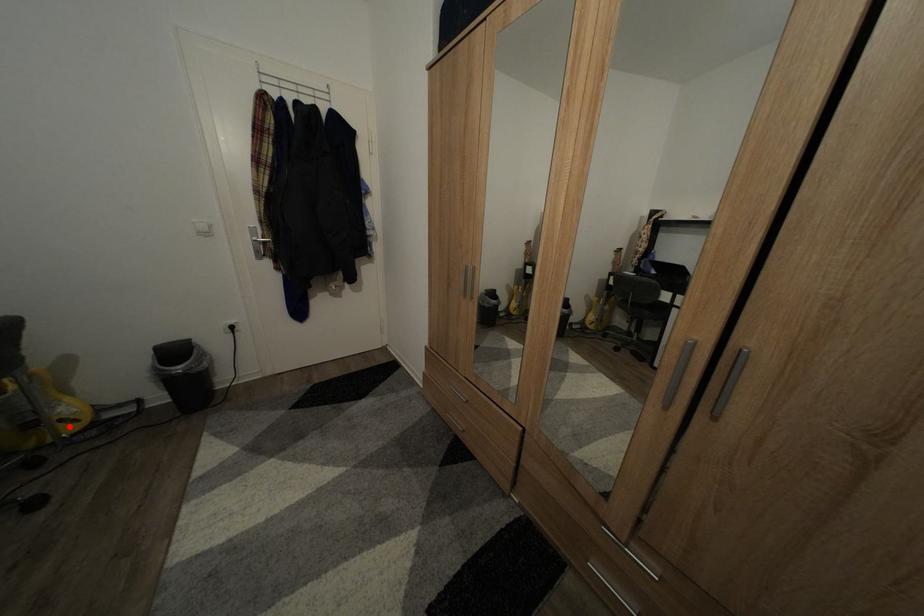
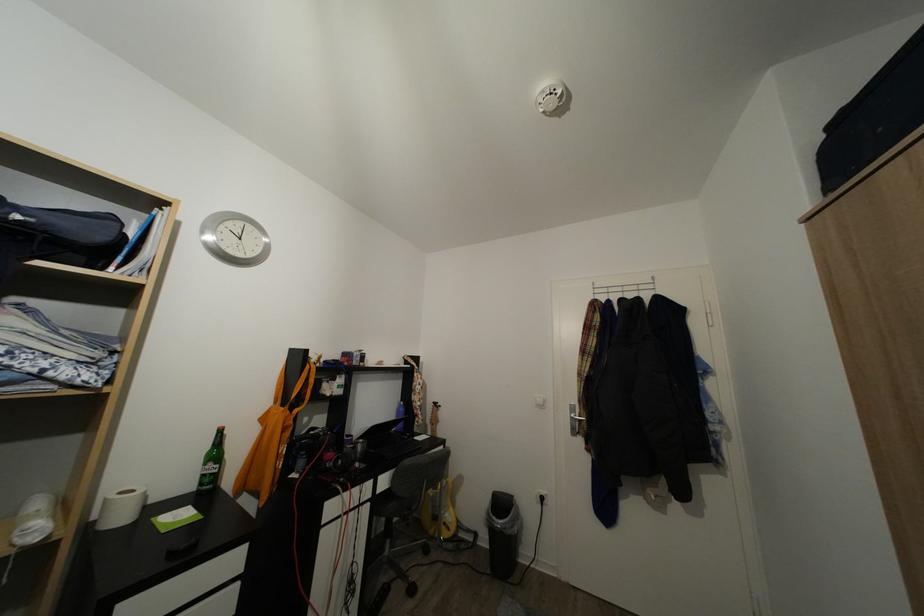
Question: I am providing you with two images of the same scene from different viewpoints. Image1 has a red point marked. In image2, the corresponding 3D location appears at what relative position? Reply with the corresponding letter.

Choices:
 (A) Closer
 (B) Farther

Answer: (A)